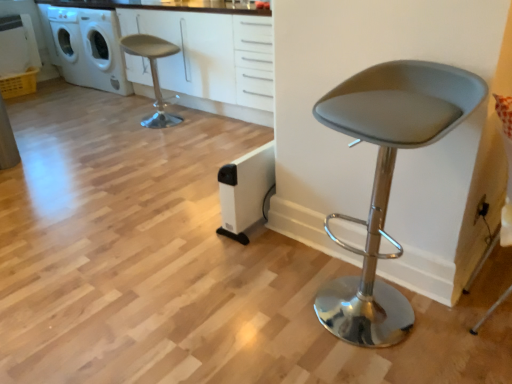
Question: Is matte gray stool at upper left, arranged as the 1th chair when viewed from the left, facing away from white plastic washing machine at upper left?

Choices:
 (A) no
 (B) yes

Answer: (A)

Question: From the image's perspective, does matte gray stool at upper left, which ranks as the 1th chair in back-to-front order, appear lower than white plastic washing machine at upper left?

Choices:
 (A) yes
 (B) no

Answer: (A)

Question: Is there a large distance between matte gray stool at upper left, the second chair from the right, and white plastic washing machine at upper left?

Choices:
 (A) no
 (B) yes

Answer: (A)

Question: From a real-world perspective, is matte gray stool at upper left, arranged as the 1th chair when viewed from the left, under white plastic washing machine at upper left?

Choices:
 (A) no
 (B) yes

Answer: (B)

Question: Is matte gray stool at upper left, arranged as the 1th chair when viewed from the left, at the right side of white plastic washing machine at upper left?

Choices:
 (A) no
 (B) yes

Answer: (B)

Question: In the image, is matte gray stool at center, which is the 2th chair from back to front, on the left side or the right side of white plastic washing machine at upper left?

Choices:
 (A) left
 (B) right

Answer: (B)

Question: Considering the positions of matte gray stool at center, positioned as the second chair in top-to-bottom order, and white plastic washing machine at upper left in the image, is matte gray stool at center, positioned as the second chair in top-to-bottom order, taller or shorter than white plastic washing machine at upper left?

Choices:
 (A) short
 (B) tall

Answer: (A)

Question: From a real-world perspective, relative to white plastic washing machine at upper left, is matte gray stool at center, positioned as the second chair in top-to-bottom order, vertically above or below?

Choices:
 (A) below
 (B) above

Answer: (A)

Question: From the image's perspective, is matte gray stool at center, placed as the first chair when sorted from right to left, positioned above or below white plastic washing machine at upper left?

Choices:
 (A) above
 (B) below

Answer: (B)

Question: In terms of height, does matte gray stool at upper left, which is the first chair from top to bottom, look taller or shorter compared to white plastic washing machine at upper left?

Choices:
 (A) short
 (B) tall

Answer: (A)

Question: Looking at their shapes, would you say matte gray stool at upper left, marked as the second chair in a front-to-back arrangement, is wider or thinner than white plastic washing machine at upper left?

Choices:
 (A) wide
 (B) thin

Answer: (B)

Question: Would you say matte gray stool at upper left, arranged as the 1th chair when viewed from the left, is inside or outside white plastic washing machine at upper left?

Choices:
 (A) outside
 (B) inside

Answer: (A)

Question: From the image's perspective, is matte gray stool at upper left, the second chair from the right, positioned above or below white plastic washing machine at upper left?

Choices:
 (A) above
 (B) below

Answer: (B)

Question: In terms of size, does white matte cabinet at upper center appear bigger or smaller than white plastic washing machine at upper left?

Choices:
 (A) big
 (B) small

Answer: (A)

Question: In the image, is white matte cabinet at upper center positioned in front of or behind white plastic washing machine at upper left?

Choices:
 (A) behind
 (B) front

Answer: (B)